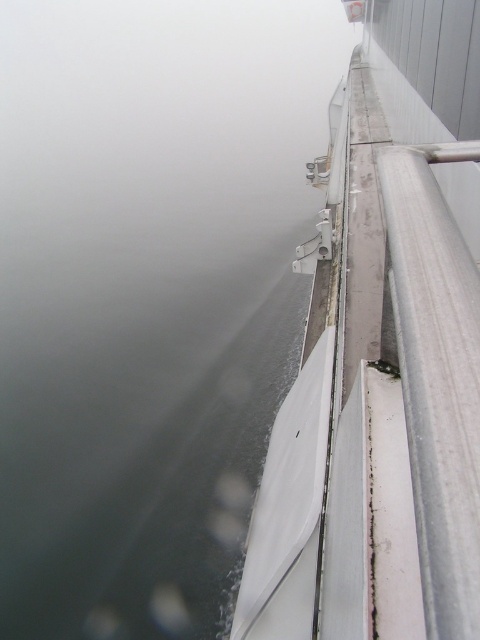
You are a sailor on the ship and need to navigate through the fog. You see the gray matte water at upper left and the white matte boat at upper right. Which object appears bigger in the scene?

The gray matte water at upper left has a larger size compared to the white matte boat at upper right, so the gray matte water at upper left appears bigger in the scene.

You are standing on the ship deck and see the gray matte water at upper left and the white matte boat at upper right. Which object is closer to you?

The gray matte water at upper left is closer to you than the white matte boat at upper right because it is further to the viewer.

You are standing on the deck of the ship and see two points marked on the railing. The first point is at coordinate point(178, 442) and the second is at point(397, 604). Which point is closer to you?

Point(397, 604) is closer to you because point(178, 442) is behind it.